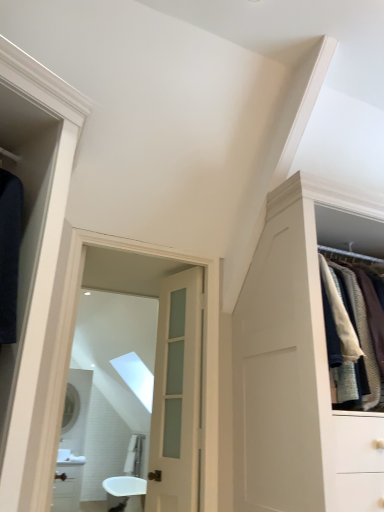
Question: In which direction should I rotate to look at clear glass mirror at center, acting as the 2th mirror starting from the back?

Choices:
 (A) right
 (B) left

Answer: (B)

Question: From the image's perspective, does matte silver mirror at center, placed as the 1th mirror when sorted from left to right, appear higher than white glossy sink at center?

Choices:
 (A) no
 (B) yes

Answer: (B)

Question: Is matte silver mirror at center, the second mirror when ordered from right to left, located outside white glossy sink at center?

Choices:
 (A) no
 (B) yes

Answer: (B)

Question: Are matte silver mirror at center, placed as the 1th mirror when sorted from left to right, and white glossy sink at center far apart?

Choices:
 (A) yes
 (B) no

Answer: (B)

Question: Does matte silver mirror at center, positioned as the 2th mirror in front-to-back order, have a lesser height compared to white glossy sink at center?

Choices:
 (A) no
 (B) yes

Answer: (A)

Question: Can you confirm if matte silver mirror at center, the first mirror positioned from the bottom, is positioned to the left of white glossy sink at center?

Choices:
 (A) no
 (B) yes

Answer: (B)

Question: Is matte silver mirror at center, the second mirror when ordered from right to left, closer to the viewer compared to white glossy sink at center?

Choices:
 (A) yes
 (B) no

Answer: (B)

Question: From the image's perspective, is matte silver mirror at center, placed as the 1th mirror when sorted from left to right, below clear glass mirror at center, positioned as the 2th mirror in bottom-to-top order?

Choices:
 (A) no
 (B) yes

Answer: (B)

Question: Is matte silver mirror at center, placed as the 1th mirror when sorted from left to right, oriented towards clear glass mirror at center, acting as the 2th mirror starting from the back?

Choices:
 (A) yes
 (B) no

Answer: (A)

Question: Considering the relative sizes of matte silver mirror at center, the second mirror when ordered from right to left, and clear glass mirror at center, positioned as the 1th mirror in right-to-left order, in the image provided, is matte silver mirror at center, the second mirror when ordered from right to left, shorter than clear glass mirror at center, positioned as the 1th mirror in right-to-left order,?

Choices:
 (A) no
 (B) yes

Answer: (B)

Question: Is the depth of matte silver mirror at center, positioned as the 2th mirror in front-to-back order, greater than that of clear glass mirror at center, acting as the 2th mirror starting from the back?

Choices:
 (A) no
 (B) yes

Answer: (B)

Question: Is matte silver mirror at center, positioned as the 2th mirror in front-to-back order, looking in the opposite direction of clear glass mirror at center, positioned as the 1th mirror in front-to-back order?

Choices:
 (A) no
 (B) yes

Answer: (A)

Question: Is matte silver mirror at center, the second mirror when ordered from right to left, not inside clear glass mirror at center, the 2th mirror in the left-to-right sequence?

Choices:
 (A) no
 (B) yes

Answer: (B)

Question: Does clear glass mirror at center, positioned as the 1th mirror in right-to-left order, have a smaller size compared to satin white door at center?

Choices:
 (A) no
 (B) yes

Answer: (A)